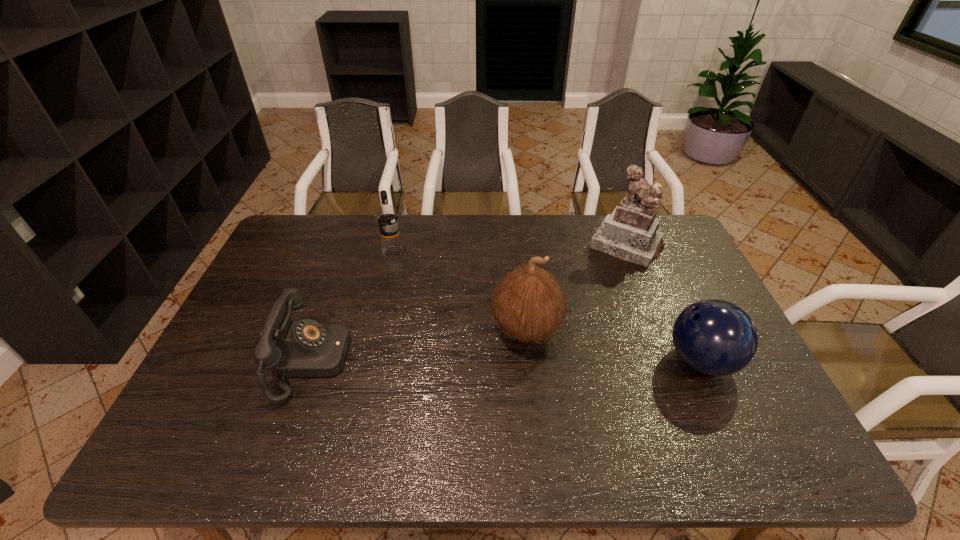
Identify the location of telephone. (305, 348).

The image size is (960, 540). I want to click on the shortest object, so click(x=305, y=348).

I want to click on bowling ball, so click(x=714, y=337).

Find the location of `the third object from right to left`. the third object from right to left is located at coordinates (529, 304).

Where is `the third shortest object`? the third shortest object is located at coordinates (387, 217).

You are a GUI agent. You are given a task and a screenshot of the screen. Output one action in this format:
    pyautogui.click(x=<x>, y=<y>)
    Task: Click on the fourth object from right to left
    The height and width of the screenshot is (540, 960).
    Given the screenshot: What is the action you would take?
    pyautogui.click(x=387, y=217)

Locate an element on the screen. Image resolution: width=960 pixels, height=540 pixels. figurine is located at coordinates (630, 233).

I want to click on free space located 0.380m on the dial of the shortest object, so click(x=489, y=360).

Where is `free space located 0.360m on the surface of the bowling ball near the finger holes`? This screenshot has height=540, width=960. free space located 0.360m on the surface of the bowling ball near the finger holes is located at coordinates click(x=530, y=361).

This screenshot has height=540, width=960. In order to click on vacant region located on the surface of the bowling ball near the finger holes in this screenshot , I will do `click(636, 361)`.